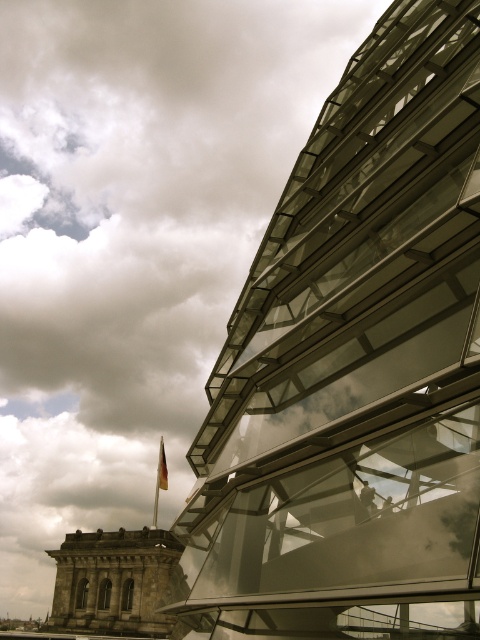
Question: Which is farther from the yellow fabric flag at lower left?

Choices:
 (A) stone tower at lower left
 (B) transparent glass tower at upper right

Answer: (B)

Question: Which of the following is the farthest from the observer?

Choices:
 (A) (448, 481)
 (B) (93, 593)
 (C) (164, 464)

Answer: (C)

Question: Is transparent glass tower at upper right to the left of stone tower at lower left from the viewer's perspective?

Choices:
 (A) no
 (B) yes

Answer: (A)

Question: Is transparent glass tower at upper right smaller than stone tower at lower left?

Choices:
 (A) no
 (B) yes

Answer: (A)

Question: Is transparent glass tower at upper right further to camera compared to stone tower at lower left?

Choices:
 (A) yes
 (B) no

Answer: (B)

Question: Which object is the closest to the transparent glass tower at upper right?

Choices:
 (A) yellow fabric flag at lower left
 (B) stone tower at lower left

Answer: (B)